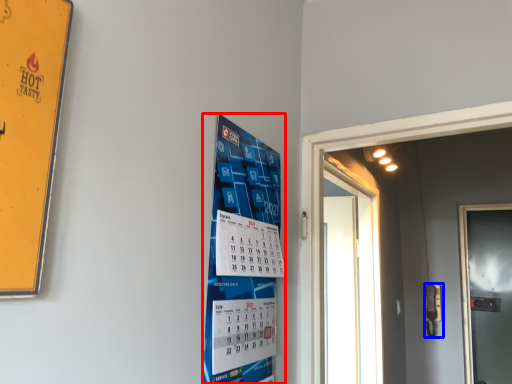
Question: Which point is closer to the camera, poster (highlighted by a red box) or door handle (highlighted by a blue box)?

Choices:
 (A) poster
 (B) door handle

Answer: (A)